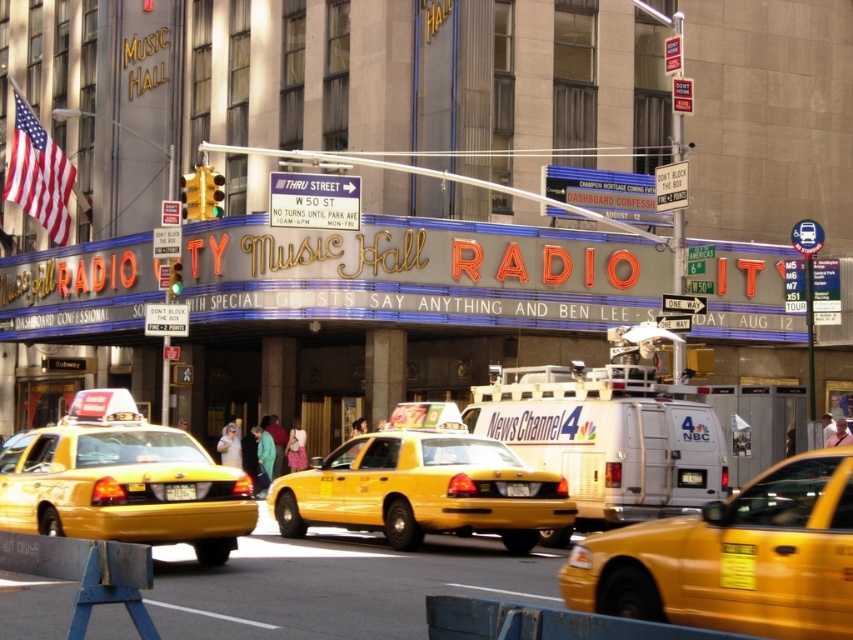
You are a tourist standing on the sidewalk in front of Radio City Music Hall. You see a yellow plastic taxi cab at center and a white plastic sign at upper center. Which object is closer to your left side?

The yellow plastic taxi cab at center is closer to your left side because it is positioned to the left of the white plastic sign at upper center.

You are standing at the entrance of Radio City Music Hall and see two yellow taxis, a yellow rubber taxi at center and a yellow plastic taxi at center. You need to walk to the one that is closer to you. Which one should you go to?

Both yellow rubber taxi at center and yellow plastic taxi at center are at the same center position, so you can choose either one.

You are a delivery driver who needs to park your white metallic van at center near Radio City Music Hall. However, there is a height restriction indicated by the white plastic sign at upper center. Can your van pass under the sign without hitting it?

The white metallic van at center is much taller than the white plastic sign at upper center. Therefore, the van cannot pass under the sign without hitting it because it exceeds the height restriction indicated by the sign.